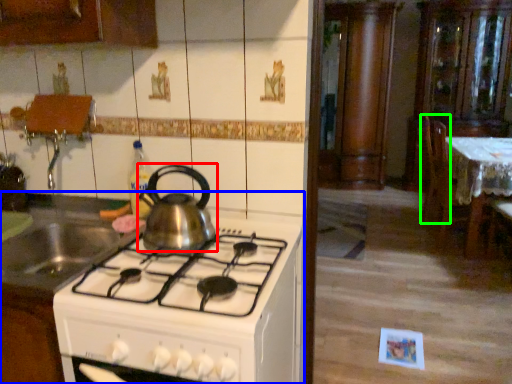
Question: Based on their relative distances, which object is nearer to kitchen appliance (highlighted by a red box)? Choose from kitchen appliance (highlighted by a blue box) and chair (highlighted by a green box).

Choices:
 (A) kitchen appliance
 (B) chair

Answer: (A)